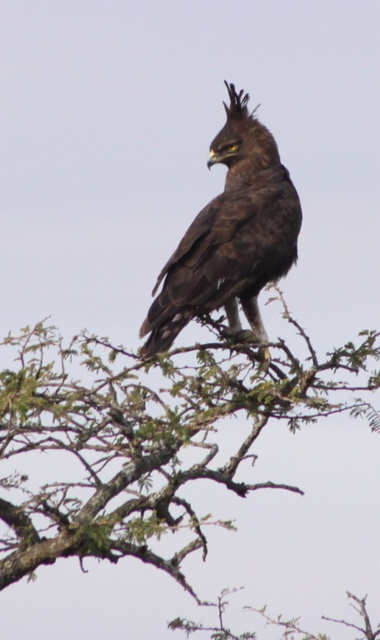
From the picture: You are looking at the image and want to determine which of the two points, point [280,374] or point [210,160], is closer to you. Based on the scene, which point is nearer?

Point [280,374] is closer to the camera than point [210,160].

You are an ornithologist observing an eagle in its natural habitat. You notice the green leafy branch at upper center and the dark brown feathers at center. Which object is positioned closer to your line of sight?

The green leafy branch at upper center is closer to the viewer than the dark brown feathers at center.

You are an ornithologist observing an eagle perched on a branch in a semi arid environment. The eagle is on the green leafy branch at upper center. If you want to place a camera at coordinate point 0.683, 0.392 to capture the eagle, will the camera be positioned correctly?

The green leafy branch at upper center is located at point (148, 436), so placing the camera at that coordinate will position it correctly to capture the eagle on the green leafy branch at upper center.